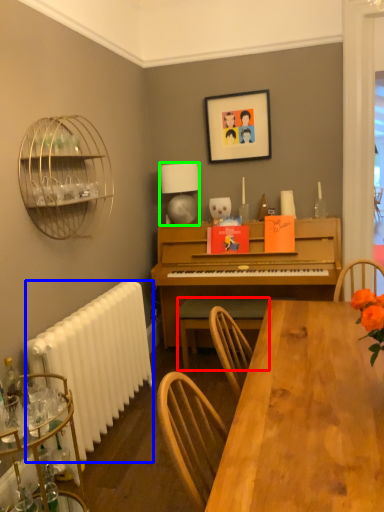
Question: Which object is the farthest from chair (highlighted by a red box)? Choose among these: radiator (highlighted by a blue box) or lamp (highlighted by a green box).

Choices:
 (A) radiator
 (B) lamp

Answer: (B)